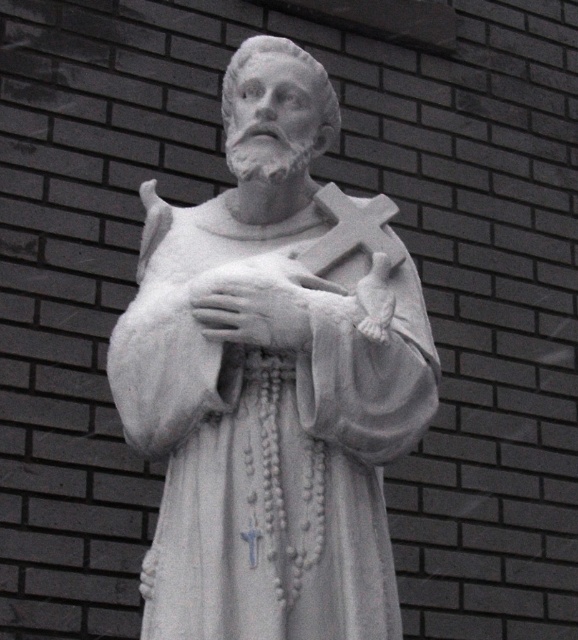
Can you confirm if white marble statue at center is taller than white stone cross at center?

Yes, white marble statue at center is taller than white stone cross at center.

Is white marble statue at center bigger than white stone cross at center?

Yes.

Describe the element at coordinates (272, 378) in the screenshot. The height and width of the screenshot is (640, 578). I see `white marble statue at center` at that location.

Where is `white marble statue at center`? The image size is (578, 640). white marble statue at center is located at coordinates (272, 378).